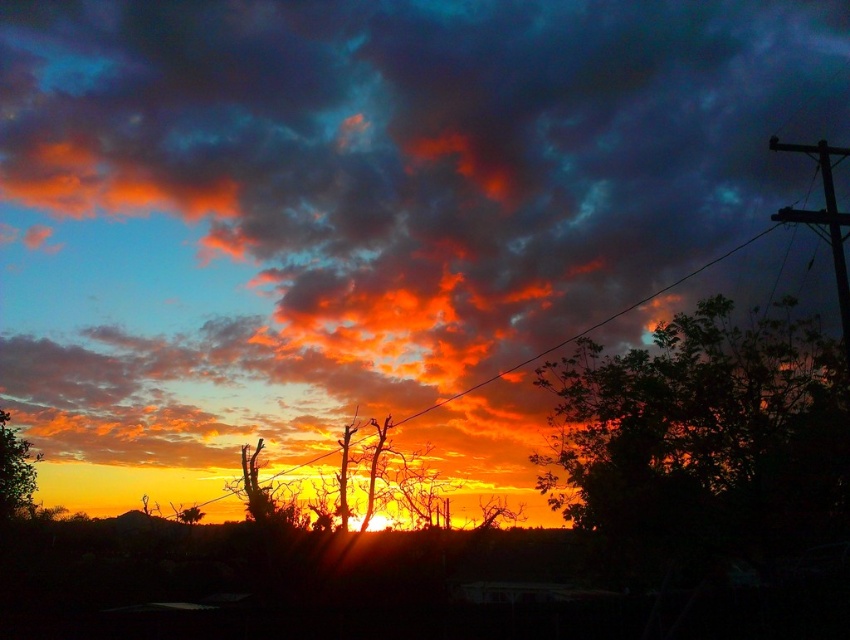
In the sunset scene, you notice two trees, the dark green leafy tree at right and the green matte tree at lower left. Which tree would cast a longer shadow on the ground?

The dark green leafy tree at right is larger in size than the green matte tree at lower left, so it would cast a longer shadow on the ground.

You are an artist setting up your easel to paint the sunset scene. You want to position your easel so that both the dark green leafy tree at right and the green matte tree at lower left are visible in your painting. Based on their positions, which tree should you place on the right side of your canvas?

The dark green leafy tree at right should be placed on the right side of your canvas because it is positioned to the right of the green matte tree at lower left in the scene.